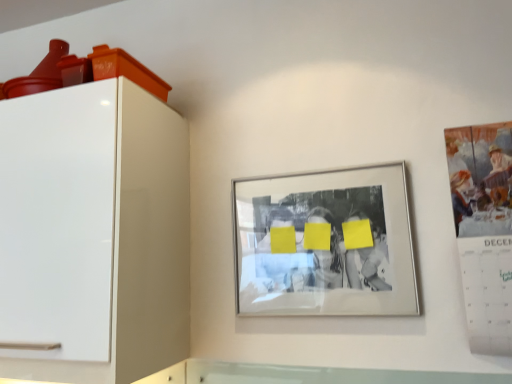
Question: Is the surface of white glossy cabinet at left in direct contact with silver metallic picture frame at center?

Choices:
 (A) yes
 (B) no

Answer: (B)

Question: From the image's perspective, would you say white glossy cabinet at left is positioned over silver metallic picture frame at center?

Choices:
 (A) yes
 (B) no

Answer: (A)

Question: Considering the relative positions of white glossy cabinet at left and silver metallic picture frame at center in the image provided, is white glossy cabinet at left to the left of silver metallic picture frame at center from the viewer's perspective?

Choices:
 (A) no
 (B) yes

Answer: (B)

Question: Can you confirm if white glossy cabinet at left is bigger than silver metallic picture frame at center?

Choices:
 (A) yes
 (B) no

Answer: (A)

Question: From the image's perspective, does white glossy cabinet at left appear lower than silver metallic picture frame at center?

Choices:
 (A) yes
 (B) no

Answer: (B)

Question: Is silver metallic picture frame at center at the back of white glossy cabinet at left?

Choices:
 (A) yes
 (B) no

Answer: (B)

Question: Is silver metallic picture frame at center taller than white glossy cabinet at left?

Choices:
 (A) no
 (B) yes

Answer: (A)

Question: Considering the relative sizes of silver metallic picture frame at center and white glossy cabinet at left in the image provided, is silver metallic picture frame at center thinner than white glossy cabinet at left?

Choices:
 (A) no
 (B) yes

Answer: (B)

Question: Does silver metallic picture frame at center appear on the left side of white glossy cabinet at left?

Choices:
 (A) no
 (B) yes

Answer: (A)

Question: Can we say silver metallic picture frame at center lies outside white glossy cabinet at left?

Choices:
 (A) yes
 (B) no

Answer: (A)

Question: Is silver metallic picture frame at center closer to camera compared to white glossy cabinet at left?

Choices:
 (A) no
 (B) yes

Answer: (A)

Question: Is white glossy cabinet at left located within silver metallic picture frame at center?

Choices:
 (A) yes
 (B) no

Answer: (B)

Question: Does white glossy cabinet at left lie in front of matte paper calendar at right?

Choices:
 (A) yes
 (B) no

Answer: (A)